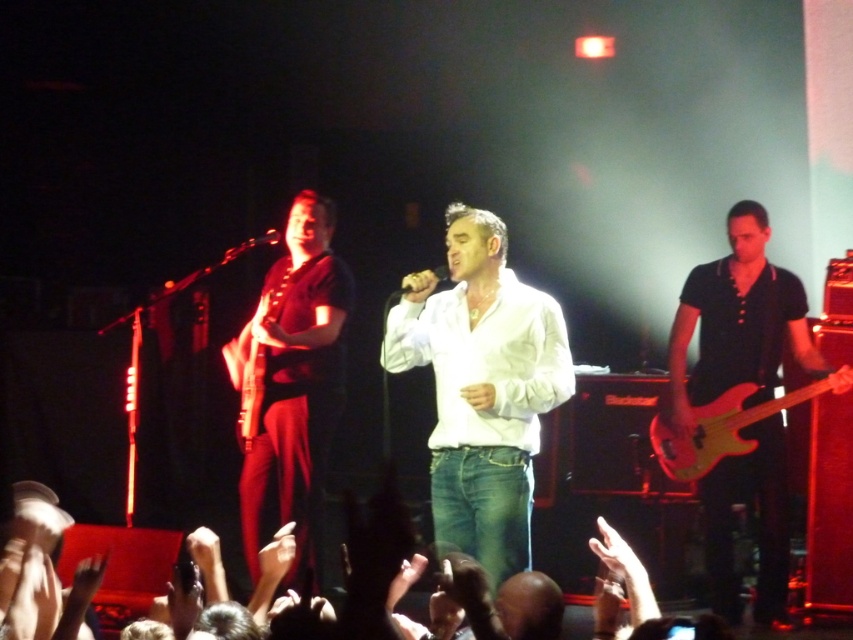
Between matte red electric bass at right and wooden electric guitar at center, which one appears on the left side from the viewer's perspective?

wooden electric guitar at center

The height and width of the screenshot is (640, 853). Describe the element at coordinates (724, 426) in the screenshot. I see `matte red electric bass at right` at that location.

The image size is (853, 640). In order to click on matte red electric bass at right in this screenshot , I will do `click(724, 426)`.

Is white matte shirt at center below wooden electric guitar at center?

Yes.

Is white matte shirt at center smaller than wooden electric guitar at center?

Incorrect, white matte shirt at center is not smaller in size than wooden electric guitar at center.

Measure the distance between white matte shirt at center and camera.

A distance of 3.87 meters exists between white matte shirt at center and camera.

Find the location of a particular element. The image size is (853, 640). white matte shirt at center is located at coordinates (480, 387).

Is matte black bass guitar at right below matte red electric bass at right?

Actually, matte black bass guitar at right is above matte red electric bass at right.

Where is `matte black bass guitar at right`? matte black bass guitar at right is located at coordinates (740, 323).

The width and height of the screenshot is (853, 640). Identify the location of matte black bass guitar at right. (740, 323).